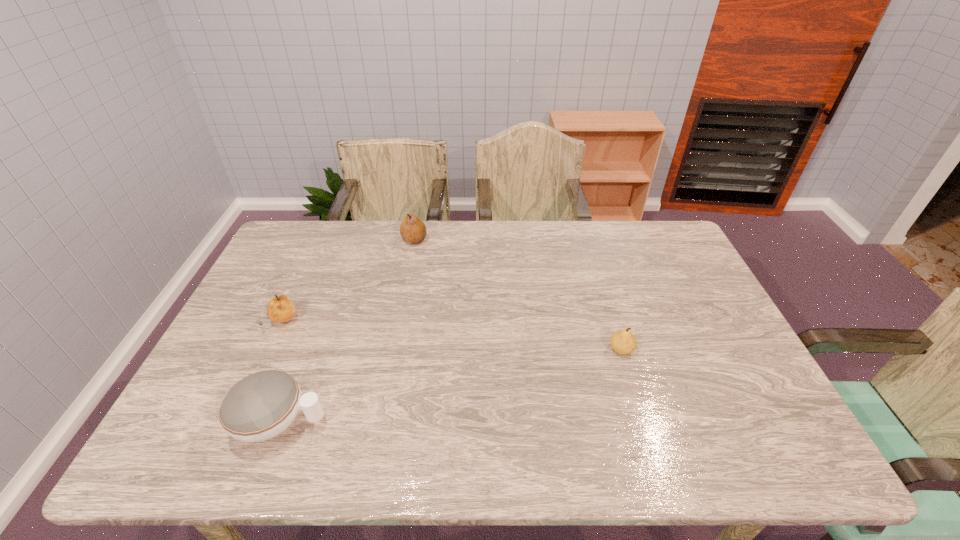
At what (x,y) coordinates should I click in order to perform the action: click on the farthest object. Please return your answer as a coordinate pair (x, y). The height and width of the screenshot is (540, 960). Looking at the image, I should click on (412, 229).

The image size is (960, 540). I want to click on the farthest pear, so click(x=412, y=229).

Locate an element on the screen. The image size is (960, 540). the second farthest pear is located at coordinates (280, 309).

Find the location of `the third nearest object`. the third nearest object is located at coordinates (280, 309).

At what (x,y) coordinates should I click in order to perform the action: click on the nearest pear. Please return your answer as a coordinate pair (x, y). This screenshot has width=960, height=540. Looking at the image, I should click on (623, 342).

Locate an element on the screen. the third farthest object is located at coordinates (623, 342).

This screenshot has height=540, width=960. Find the location of `chinaware`. chinaware is located at coordinates (260, 406).

This screenshot has width=960, height=540. Find the location of `vacant space located 0.260m on the front of the tallest pear`. vacant space located 0.260m on the front of the tallest pear is located at coordinates (403, 301).

I want to click on free space located 0.310m on the front of the leftmost pear, so click(x=229, y=438).

In order to click on vacant space located on the right of the rightmost object in this screenshot , I will do `click(724, 350)`.